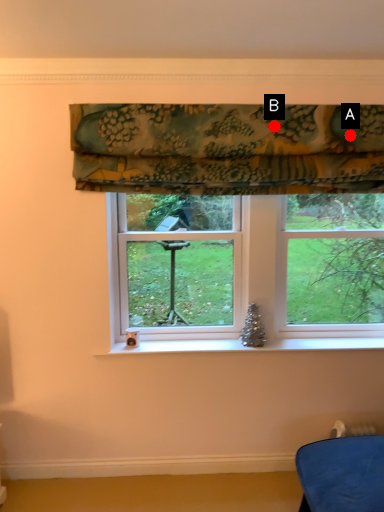
Question: Two points are circled on the image, labeled by A and B beside each circle. Which point is closer to the camera taking this photo?

Choices:
 (A) A is closer
 (B) B is closer

Answer: (B)